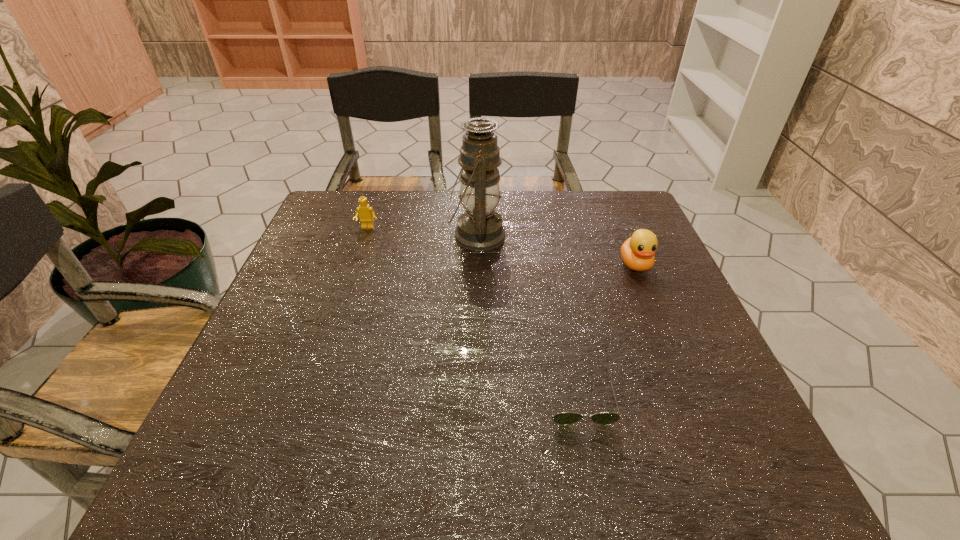
What are the coordinates of `vacant space in between the leftmost object and the tallest object` in the screenshot? It's located at (422, 232).

Select which object is the closest to the duckling. Please provide its 2D coordinates. Your answer should be formatted as a tuple, i.e. [(x, y)], where the tuple contains the x and y coordinates of a point satisfying the conditions above.

[(480, 228)]

Select which object is the closest to the duckling. Please provide its 2D coordinates. Your answer should be formatted as a tuple, i.e. [(x, y)], where the tuple contains the x and y coordinates of a point satisfying the conditions above.

[(480, 228)]

The width and height of the screenshot is (960, 540). I want to click on vacant space that satisfies the following two spatial constraints: 1. on the face of the leftmost object; 2. on the right side of the oil lamp, so click(x=365, y=236).

Find the location of a particular element. vacant point that satisfies the following two spatial constraints: 1. on the face of the leftmost object; 2. on the left side of the tallest object is located at coordinates point(365,236).

This screenshot has height=540, width=960. Identify the location of free spot that satisfies the following two spatial constraints: 1. on the face of the leftmost object; 2. on the right side of the tallest object. (365, 236).